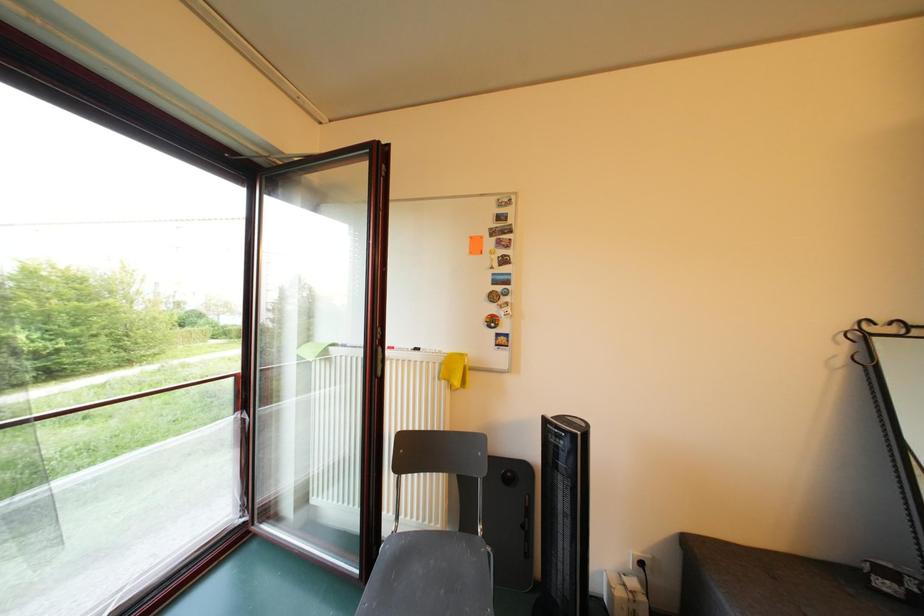
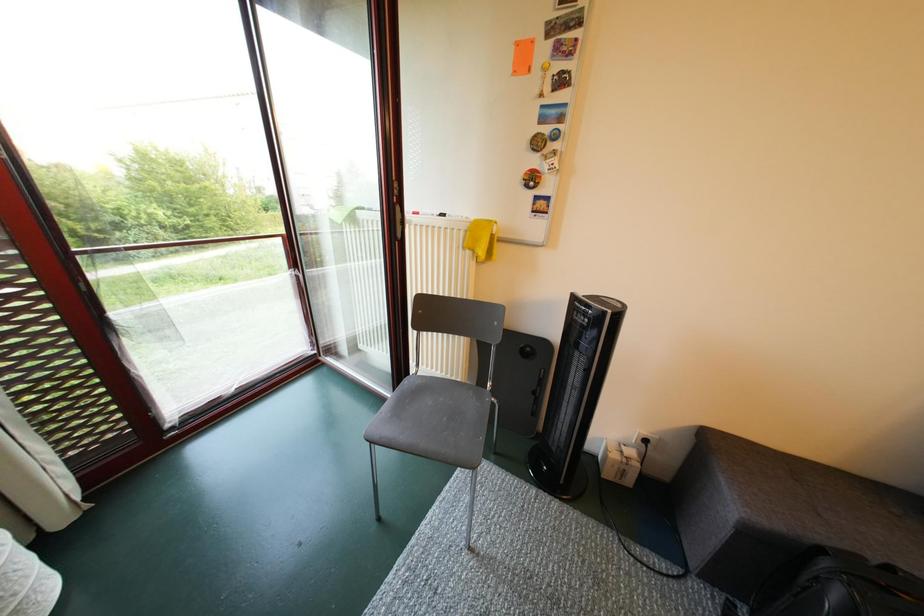
In a continuous first-person perspective shot, in which direction is the camera moving?

The cameraman walked toward right, forward.